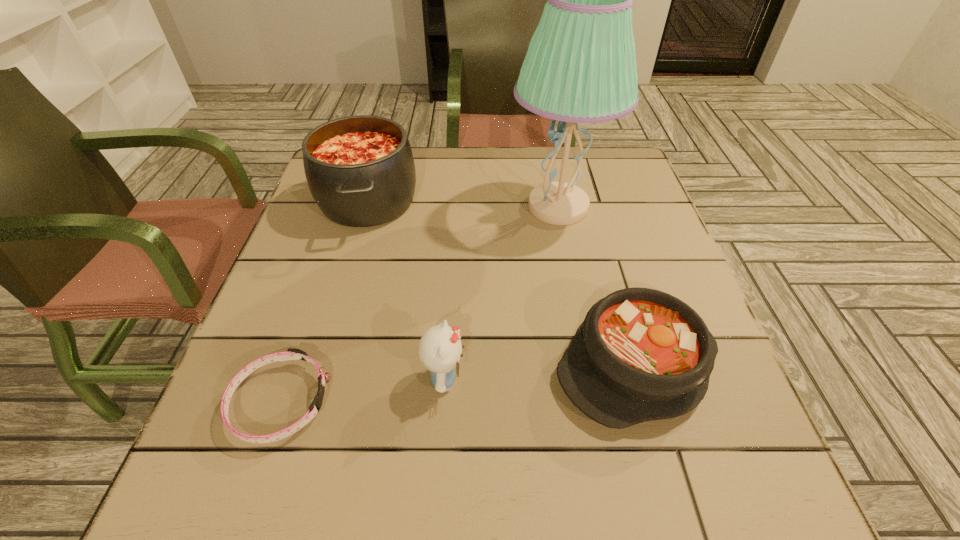
Where is `object that is at the far right corner`? This screenshot has height=540, width=960. object that is at the far right corner is located at coordinates (580, 67).

The height and width of the screenshot is (540, 960). Identify the location of blank area at the far edge. (501, 166).

This screenshot has height=540, width=960. In the image, there is a desktop. What are the coordinates of `vacant space at the near edge` in the screenshot? It's located at (308, 465).

In the image, there is a desktop. Identify the location of vacant area at the left edge. The height and width of the screenshot is (540, 960). (308, 233).

The width and height of the screenshot is (960, 540). Identify the location of vacant space at the right edge of the desktop. (614, 215).

Locate an element on the screen. This screenshot has width=960, height=540. vacant space at the near left corner is located at coordinates (222, 475).

The width and height of the screenshot is (960, 540). What are the coordinates of `vacant space that's between the tallest object and the fourth tallest object` in the screenshot? It's located at (597, 286).

Find the location of a particular element. The image size is (960, 540). free space between the shorter casserole and the lamp is located at coordinates (597, 286).

Where is `free space between the third shortest object and the taller casserole`? free space between the third shortest object and the taller casserole is located at coordinates (406, 290).

Find the location of a particular element. The width and height of the screenshot is (960, 540). vacant space that is in between the lamp and the fourth shortest object is located at coordinates (463, 204).